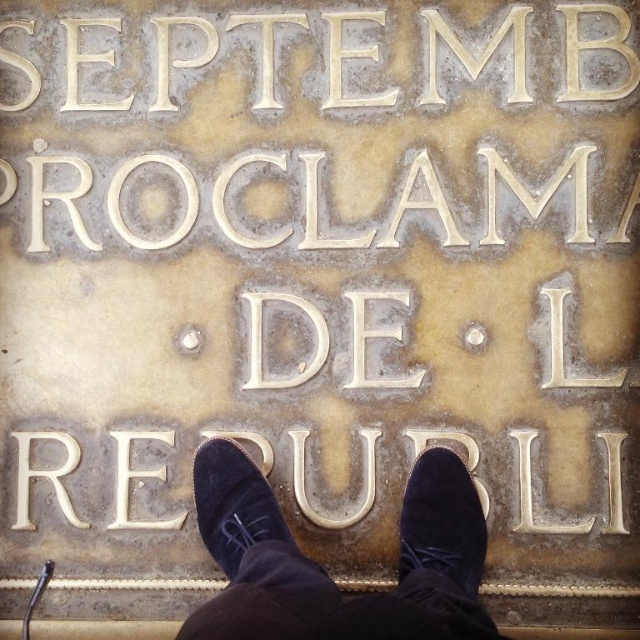
You are standing in front of the stone plaque and notice a point marked at coordinates (323, 570). Based on the scene description, what object is located at this point?

The point at coordinates (323, 570) is located on suede shoes at center.

You are standing in front of the stone plaque and want to place your suede shoes at center exactly at the point mentioned in the description. What are the coordinates where you should place them?

The suede shoes at center should be placed at the coordinates point (323, 570).